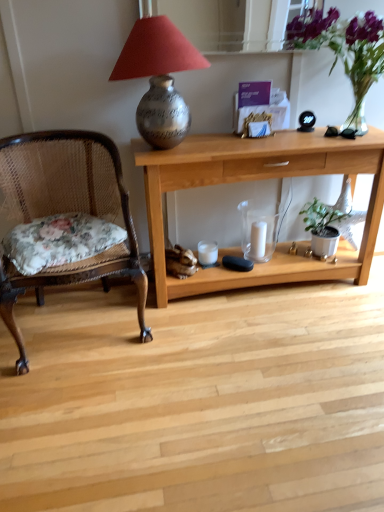
You are a GUI agent. You are given a task and a screenshot of the screen. Output one action in this format:
    pyautogui.click(x=<x>, y=<y>)
    Task: Click on the vacant area that lies between silver textured vase at upper center and purple glass vase at upper right
    
    Given the screenshot: What is the action you would take?
    pyautogui.click(x=254, y=142)